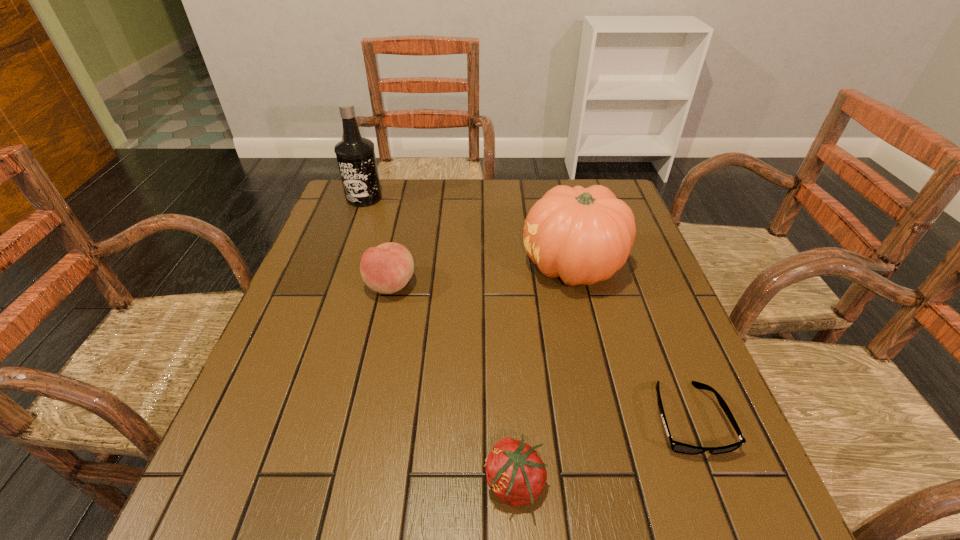
Locate an element on the screen. vacant space that satisfies the following two spatial constraints: 1. on the front label of the tallest object; 2. on the right side of the second object from left to right is located at coordinates (333, 285).